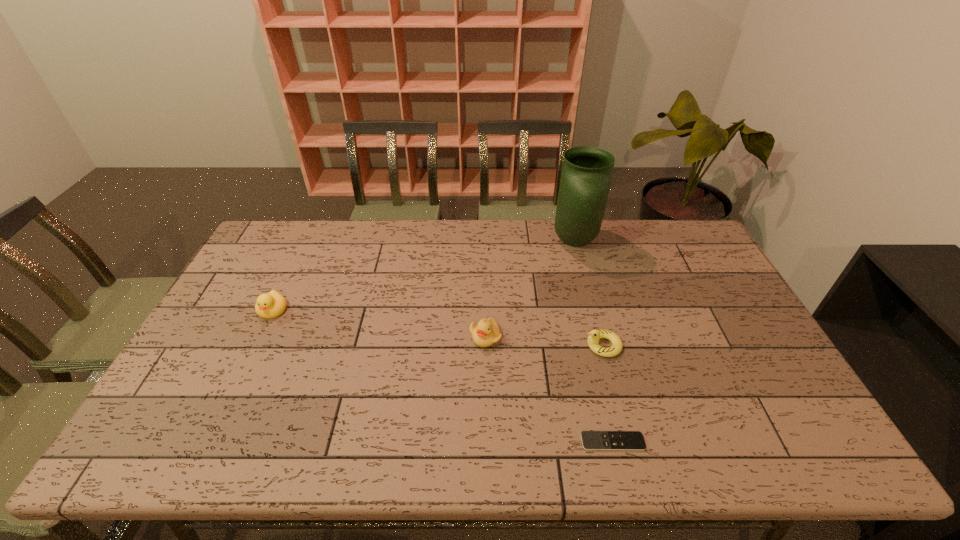
The height and width of the screenshot is (540, 960). I want to click on vacant space located 0.240m on the face of the leftmost duckling, so click(x=233, y=392).

At what (x,y) coordinates should I click in order to perform the action: click on vacant space positioned 0.070m on the face of the rightmost duckling. Please return your answer as a coordinate pair (x, y). Looking at the image, I should click on (559, 346).

Locate an element on the screen. The width and height of the screenshot is (960, 540). vacant space located on the face of the rightmost duckling is located at coordinates (563, 346).

Where is `free space located on the face of the rightmost duckling`? The height and width of the screenshot is (540, 960). free space located on the face of the rightmost duckling is located at coordinates (505, 346).

Identify the location of vacant region located 0.050m on the left of the shortest object. (560, 442).

Where is `object that is at the far edge`? object that is at the far edge is located at coordinates (586, 174).

Where is `object present at the near edge`? This screenshot has height=540, width=960. object present at the near edge is located at coordinates (591, 440).

Find the location of `object situated at the left edge`. object situated at the left edge is located at coordinates (273, 304).

The image size is (960, 540). I want to click on vacant space at the far edge of the desktop, so click(598, 253).

Locate an element on the screen. The width and height of the screenshot is (960, 540). vacant space at the near edge is located at coordinates (563, 436).